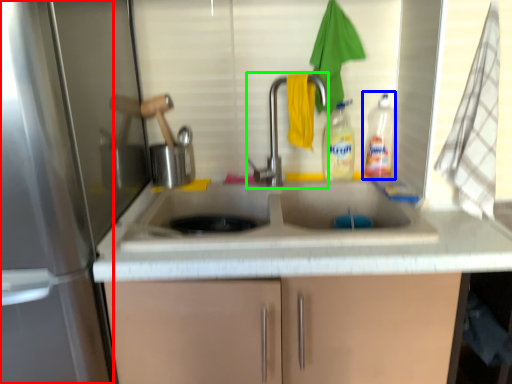
Question: Considering the real-world distances, which object is closest to screen door (highlighted by a red box)? bottle (highlighted by a blue box) or tap (highlighted by a green box).

Choices:
 (A) bottle
 (B) tap

Answer: (B)